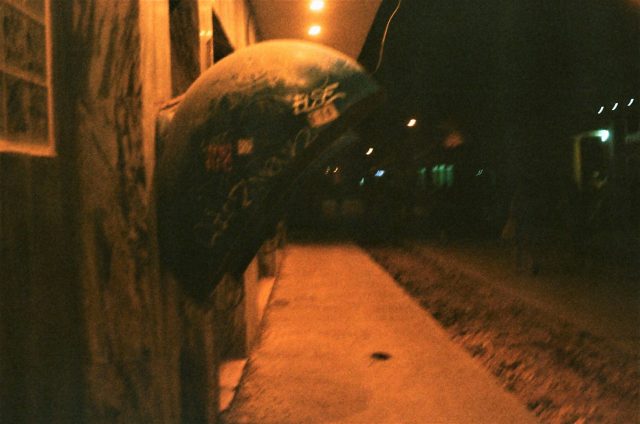
Locate an element on the screen. This screenshot has width=640, height=424. windows is located at coordinates (445, 182), (438, 181), (424, 184).